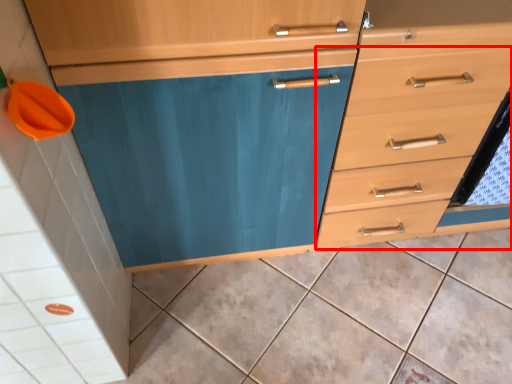
Question: From the image's perspective, what is the correct spatial positioning of drawer (annotated by the red box) in reference to ceramic tile?

Choices:
 (A) below
 (B) above

Answer: (B)